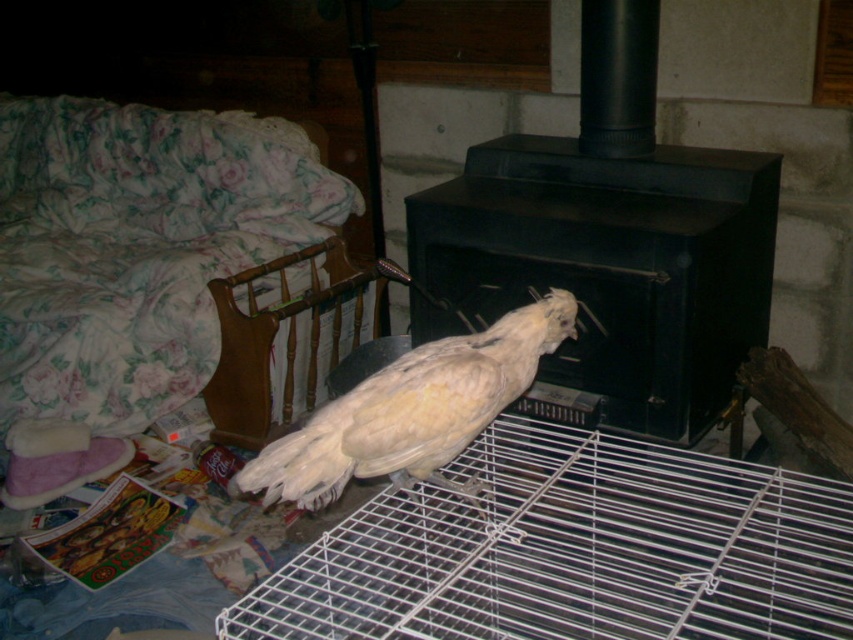
Is white wire cage at center shorter than white feathered bird at center?

Incorrect, white wire cage at center's height does not fall short of white feathered bird at center's.

Is white wire cage at center to the right of white feathered bird at center from the viewer's perspective?

Yes, white wire cage at center is to the right of white feathered bird at center.

Locate an element on the screen. white wire cage at center is located at coordinates (573, 550).

Who is higher up, white wire cage at center or black matte fireplace at center?

black matte fireplace at center is above.

Can you confirm if white wire cage at center is smaller than black matte fireplace at center?

Actually, white wire cage at center might be larger than black matte fireplace at center.

Where is `white wire cage at center`? The height and width of the screenshot is (640, 853). white wire cage at center is located at coordinates (573, 550).

Between black matte fireplace at center and white feathered bird at center, which one is positioned lower?

white feathered bird at center is below.

Is black matte fireplace at center positioned behind white feathered bird at center?

Yes, it is behind white feathered bird at center.

Describe the element at coordinates (610, 241) in the screenshot. I see `black matte fireplace at center` at that location.

Image resolution: width=853 pixels, height=640 pixels. I want to click on black matte fireplace at center, so [610, 241].